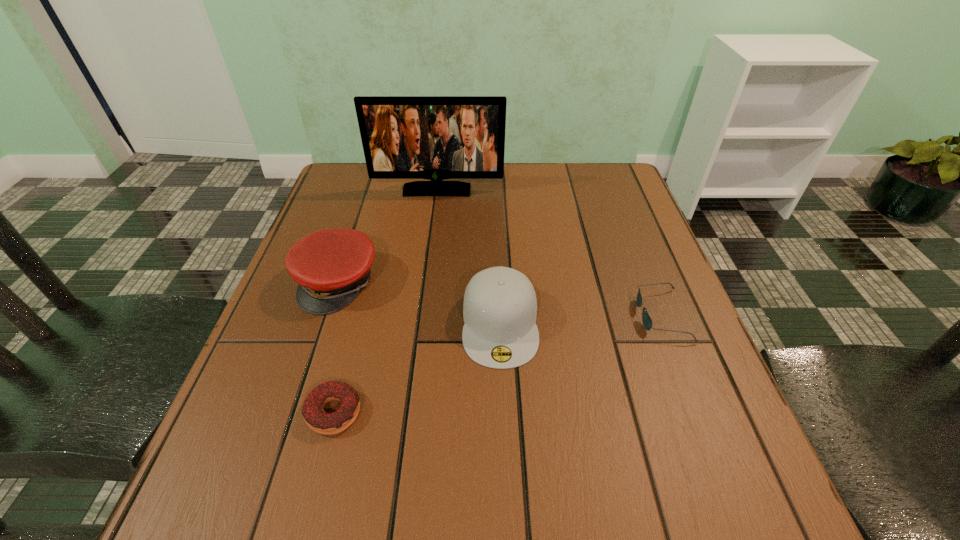
Identify the location of vacant space located on the lenses of the sunglasses. This screenshot has height=540, width=960. pos(545,315).

Where is `vacant space located on the lenses of the sunglasses`? vacant space located on the lenses of the sunglasses is located at coordinates (575, 315).

I want to click on free space located on the back of the nearest object, so click(355, 331).

This screenshot has width=960, height=540. I want to click on object positioned at the far edge, so click(x=404, y=137).

The height and width of the screenshot is (540, 960). In order to click on monitor present at the left edge in this screenshot , I will do `click(404, 137)`.

This screenshot has height=540, width=960. Identify the location of cap that is at the left edge. (331, 266).

Where is `doughnut at the left edge`? The width and height of the screenshot is (960, 540). doughnut at the left edge is located at coordinates (316, 418).

I want to click on object that is at the right edge, so click(x=647, y=322).

This screenshot has width=960, height=540. I want to click on object at the far left corner, so click(x=404, y=137).

The image size is (960, 540). Find the location of `vacant space at the far edge`. vacant space at the far edge is located at coordinates (458, 208).